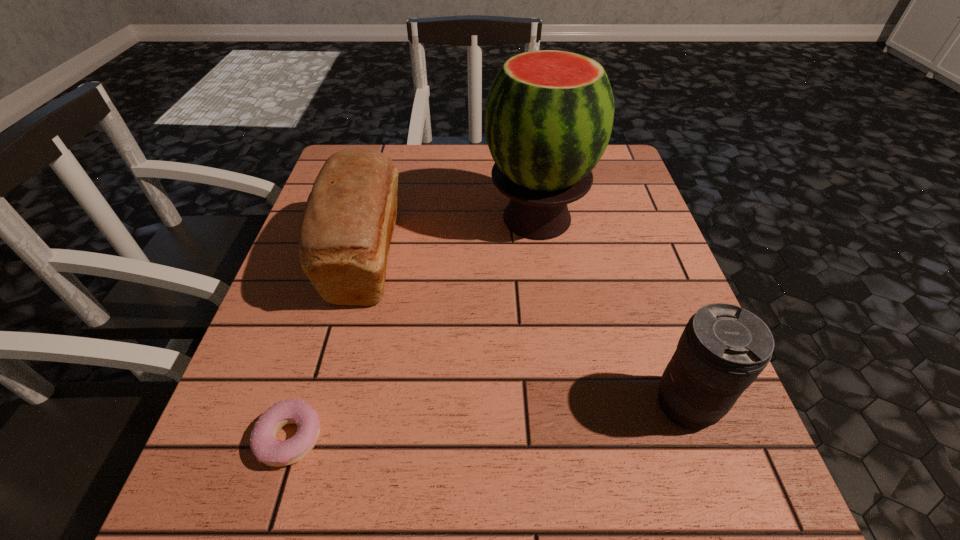
You are a GUI agent. You are given a task and a screenshot of the screen. Output one action in this format:
    pyautogui.click(x=<x>, y=<y>)
    Task: Click on the third object from left to right
    
    Given the screenshot: What is the action you would take?
    pyautogui.click(x=549, y=114)

Locate an element on the screen. The width and height of the screenshot is (960, 540). the tallest object is located at coordinates (549, 114).

This screenshot has width=960, height=540. I want to click on bread, so click(347, 226).

Find the location of a particular element. telephoto lens is located at coordinates (723, 349).

The height and width of the screenshot is (540, 960). What are the coordinates of `the shortest object` in the screenshot? It's located at (263, 443).

The width and height of the screenshot is (960, 540). I want to click on free space located on the front of the watermelon, so click(557, 359).

Locate an element on the screen. vacant region located on the left of the bread is located at coordinates (293, 257).

Image resolution: width=960 pixels, height=540 pixels. In order to click on free region located on the side of the rightmost object where the control switches are located in this screenshot , I will do `click(422, 405)`.

You are a GUI agent. You are given a task and a screenshot of the screen. Output one action in this format:
    pyautogui.click(x=<x>, y=<y>)
    Task: Click on the vacant region located on the side of the rightmost object where the control switches are located
    
    Given the screenshot: What is the action you would take?
    pyautogui.click(x=448, y=405)

The width and height of the screenshot is (960, 540). In order to click on vacant space located 0.380m on the side of the rightmost object where the control switches are located in this screenshot , I will do `click(410, 405)`.